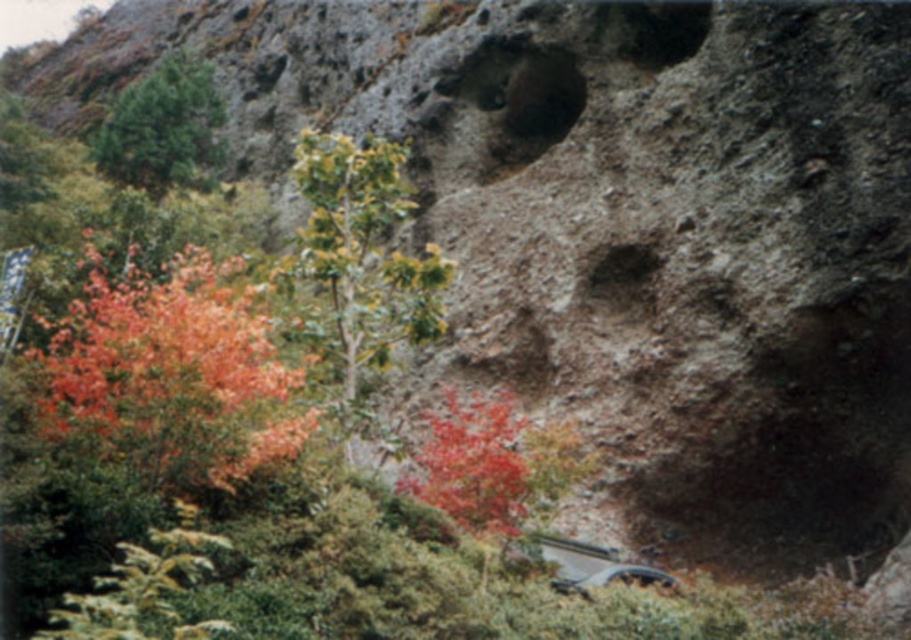
You are driving a metallic silver car at lower center and want to exit the scene. To do so, you need to pass in front of the green matte tree at upper left. Is this possible given their current positions?

The metallic silver car at lower center is behind the green matte tree at upper left, so it cannot pass in front of it without moving around the tree first.

You are standing in the natural landscape and want to take a photo of both the green leafy tree at center and the metallic silver car at lower center. Which object should you focus on first to ensure both are in clear view?

You should focus on the green leafy tree at center first because it is closer to you than the metallic silver car at lower center, ensuring both are in clear view.